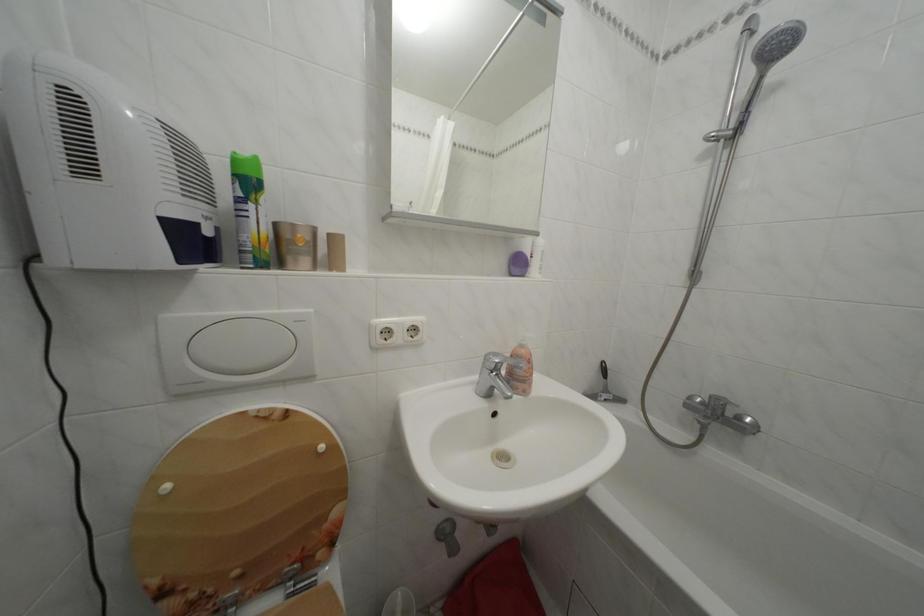
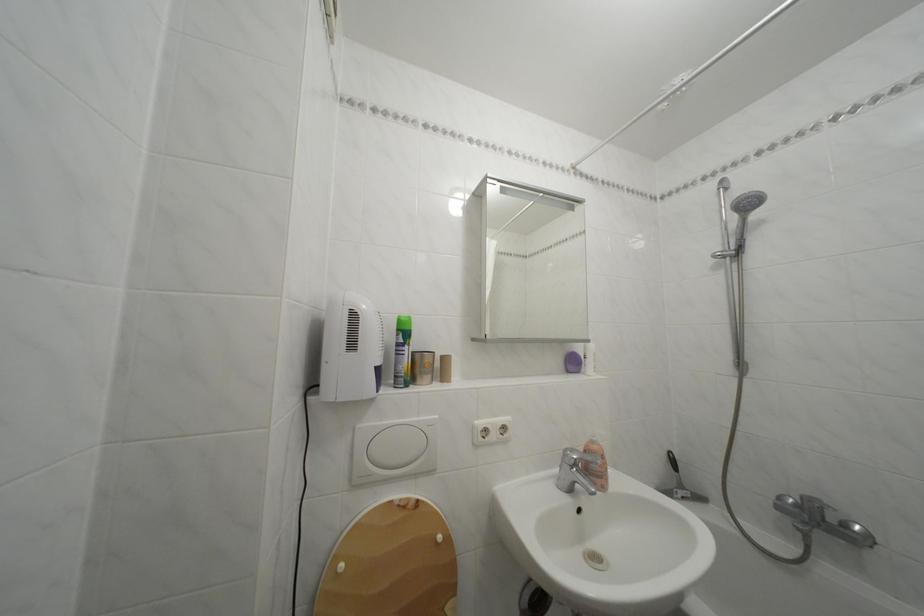
Where in the second image is the point corresponding to (613,377) from the first image?

(682, 468)